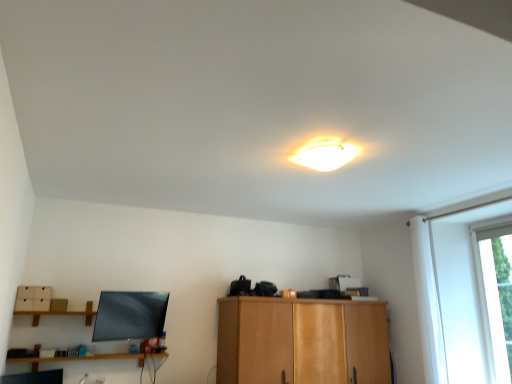
Question: Does wooden shelf at lower left have a lesser height compared to transparent glass window at right?

Choices:
 (A) yes
 (B) no

Answer: (A)

Question: Is transparent glass window at right located within wooden shelf at lower left?

Choices:
 (A) no
 (B) yes

Answer: (A)

Question: From a real-world perspective, is wooden shelf at lower left below transparent glass window at right?

Choices:
 (A) no
 (B) yes

Answer: (B)

Question: Is wooden shelf at lower left next to transparent glass window at right and touching it?

Choices:
 (A) no
 (B) yes

Answer: (A)

Question: Can you confirm if wooden shelf at lower left is bigger than transparent glass window at right?

Choices:
 (A) no
 (B) yes

Answer: (B)

Question: From the image's perspective, does wooden shelf at lower left appear higher than transparent glass window at right?

Choices:
 (A) yes
 (B) no

Answer: (B)

Question: Does transparent glass window at right appear on the right side of white glossy ceiling light at upper center?

Choices:
 (A) yes
 (B) no

Answer: (A)

Question: Is transparent glass window at right shorter than white glossy ceiling light at upper center?

Choices:
 (A) yes
 (B) no

Answer: (B)

Question: Is transparent glass window at right looking in the opposite direction of white glossy ceiling light at upper center?

Choices:
 (A) no
 (B) yes

Answer: (A)

Question: Does transparent glass window at right have a greater height compared to white glossy ceiling light at upper center?

Choices:
 (A) no
 (B) yes

Answer: (B)

Question: Can we say transparent glass window at right lies outside white glossy ceiling light at upper center?

Choices:
 (A) no
 (B) yes

Answer: (B)

Question: Could you tell me if transparent glass window at right is facing white glossy ceiling light at upper center?

Choices:
 (A) yes
 (B) no

Answer: (A)

Question: Is white glossy ceiling light at upper center far from wooden shelf at lower left?

Choices:
 (A) yes
 (B) no

Answer: (A)